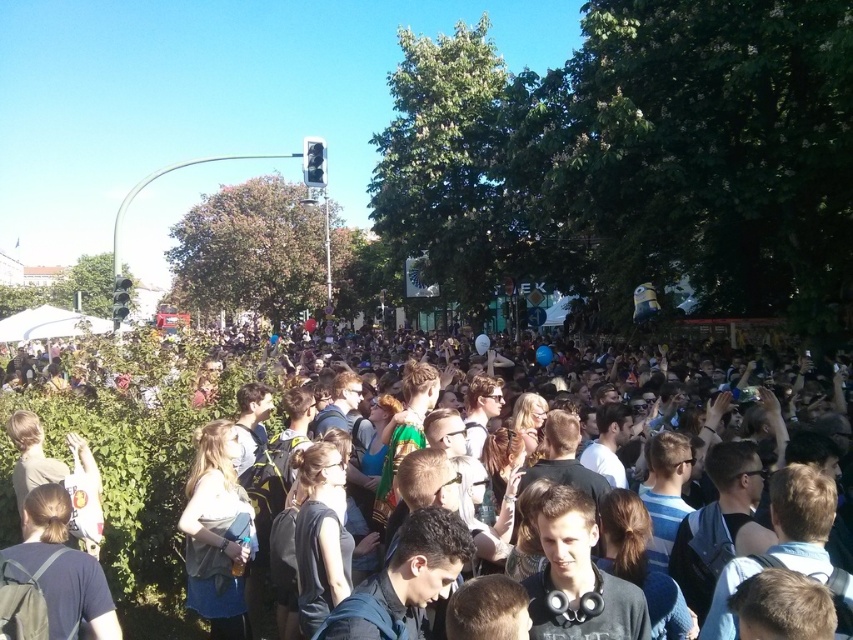
Identify the location of dark blue clothing at center. (134, 442).

Who is more forward, [170,387] or [200,554]?

Point [200,554] is in front.

Identify the location of dark blue clothing at center. The width and height of the screenshot is (853, 640). (134, 442).

Identify the location of dark blue clothing at center. click(134, 442).